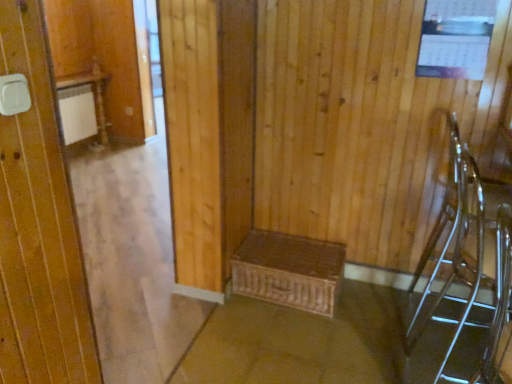
At what (x,y) coordinates should I click in order to perform the action: click on vacant area that lies between clear glass armchair at right, the 2th armchair positioned from the front, and woven brown chest at center. Please return your answer as a coordinate pair (x, y). The image size is (512, 384). Looking at the image, I should click on (349, 334).